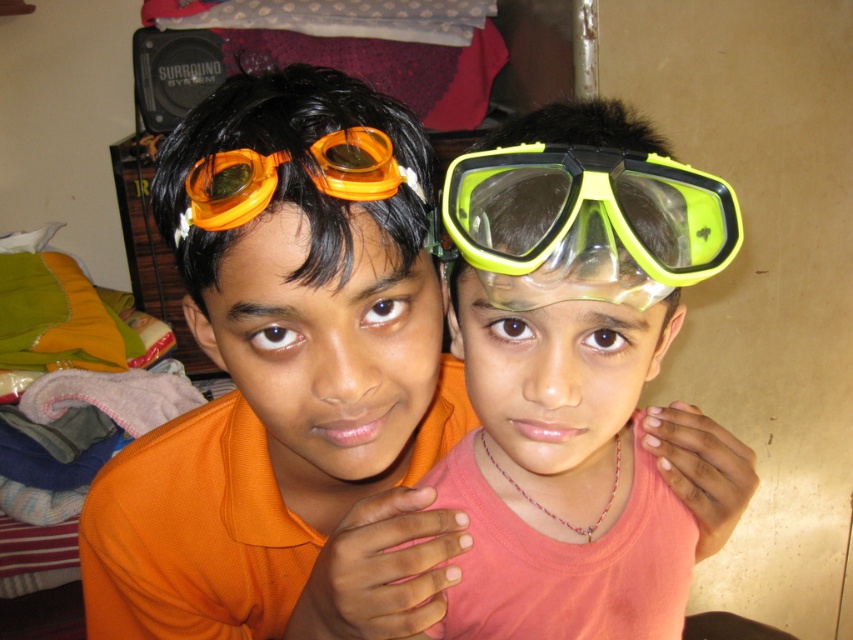
Does translucent plastic goggles at center appear on the right side of matte yellow-green snorkel mask at center?

Incorrect, translucent plastic goggles at center is not on the right side of matte yellow-green snorkel mask at center.

Does translucent plastic goggles at center have a greater height compared to matte yellow-green snorkel mask at center?

Indeed, translucent plastic goggles at center has a greater height compared to matte yellow-green snorkel mask at center.

Between point (590, 342) and point (468, 346), which one is positioned behind?

Point (468, 346)

You are a GUI agent. You are given a task and a screenshot of the screen. Output one action in this format:
    pyautogui.click(x=<x>, y=<y>)
    Task: Click on the translucent plastic goggles at center
    This screenshot has width=853, height=640.
    Given the screenshot: What is the action you would take?
    point(564,412)

Does matte orange goggles at left appear under orange matte/glossy goggles at upper left?

Yes, matte orange goggles at left is below orange matte/glossy goggles at upper left.

Looking at this image, who is positioned more to the left, matte orange goggles at left or orange matte/glossy goggles at upper left?

matte orange goggles at left is more to the left.

Which is behind, point (286, 266) or point (378, 145)?

The point (378, 145) is behind.

I want to click on matte orange goggles at left, so click(x=325, y=349).

Between matte orange goggles at left and matte yellow-green snorkel mask at center, which one appears on the right side from the viewer's perspective?

From the viewer's perspective, matte yellow-green snorkel mask at center appears more on the right side.

Is matte orange goggles at left to the right of matte yellow-green snorkel mask at center from the viewer's perspective?

In fact, matte orange goggles at left is to the left of matte yellow-green snorkel mask at center.

Between point (279, 429) and point (485, 406), which one is positioned in front?

Point (485, 406) is more forward.

Where is `matte orange goggles at left`? matte orange goggles at left is located at coordinates pyautogui.click(x=325, y=349).